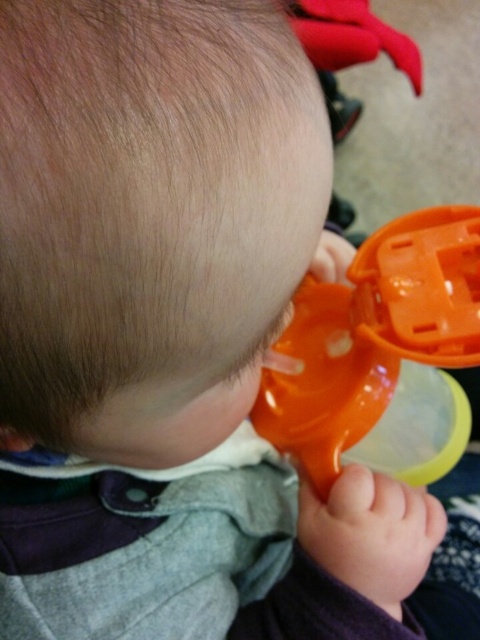
Is orange plastic sippy cup at lower right below rubberized plastic sippy cup at upper center?

Yes, orange plastic sippy cup at lower right is below rubberized plastic sippy cup at upper center.

Identify the location of orange plastic sippy cup at lower right. The image size is (480, 640). (382, 355).